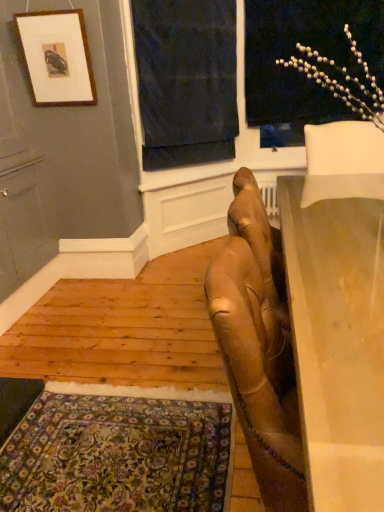
Question: Is dark blue fabric at upper center next to smooth beige table at right?

Choices:
 (A) no
 (B) yes

Answer: (A)

Question: Considering the relative sizes of dark blue fabric at upper center and smooth beige table at right in the image provided, is dark blue fabric at upper center bigger than smooth beige table at right?

Choices:
 (A) yes
 (B) no

Answer: (B)

Question: Could smooth beige table at right be considered to be inside dark blue fabric at upper center?

Choices:
 (A) yes
 (B) no

Answer: (B)

Question: Is dark blue fabric at upper center positioned with its back to smooth beige table at right?

Choices:
 (A) no
 (B) yes

Answer: (A)

Question: Considering the relative sizes of dark blue fabric at upper center and smooth beige table at right in the image provided, is dark blue fabric at upper center shorter than smooth beige table at right?

Choices:
 (A) yes
 (B) no

Answer: (B)

Question: Is dark blue fabric at upper center positioned in front of smooth beige table at right?

Choices:
 (A) no
 (B) yes

Answer: (A)

Question: Is white matte floral arrangement at upper right behind carpeted rug at lower left?

Choices:
 (A) no
 (B) yes

Answer: (B)

Question: From the image's perspective, is white matte floral arrangement at upper right over carpeted rug at lower left?

Choices:
 (A) no
 (B) yes

Answer: (B)

Question: Is carpeted rug at lower left inside white matte floral arrangement at upper right?

Choices:
 (A) yes
 (B) no

Answer: (B)

Question: Does white matte floral arrangement at upper right have a greater height compared to carpeted rug at lower left?

Choices:
 (A) no
 (B) yes

Answer: (B)

Question: From a real-world perspective, is white matte floral arrangement at upper right under carpeted rug at lower left?

Choices:
 (A) yes
 (B) no

Answer: (B)

Question: Is white matte floral arrangement at upper right looking in the opposite direction of carpeted rug at lower left?

Choices:
 (A) yes
 (B) no

Answer: (B)

Question: Can you confirm if smooth beige table at right is thinner than matte wooden picture frame at upper left?

Choices:
 (A) no
 (B) yes

Answer: (A)